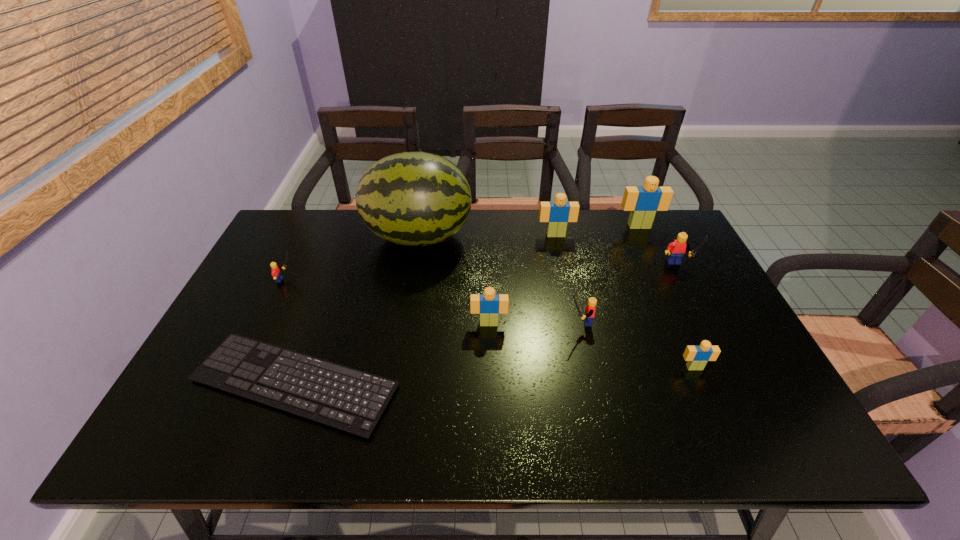
Locate an element on the screen. This screenshot has width=960, height=540. green watermelon is located at coordinates (410, 198).

The width and height of the screenshot is (960, 540). I want to click on the tallest object, so click(x=410, y=198).

This screenshot has width=960, height=540. Identify the location of the eighth shortest object. (643, 201).

The height and width of the screenshot is (540, 960). In order to click on the farthest beige Lego in this screenshot , I will do `click(643, 201)`.

This screenshot has width=960, height=540. I want to click on the third nearest beige Lego, so click(x=557, y=214).

You are a GUI agent. You are given a task and a screenshot of the screen. Output one action in this format:
    pyautogui.click(x=<x>, y=<y>)
    Task: Click on the third beige Lego from right to left
    Image resolution: width=960 pixels, height=540 pixels.
    Given the screenshot: What is the action you would take?
    tap(557, 214)

Identify the location of the rightmost yellow Lego. (x=676, y=250).

In order to click on the leftmost beige Lego in this screenshot , I will do [489, 305].

The image size is (960, 540). Find the location of `the second Lego from left to right`. the second Lego from left to right is located at coordinates (489, 305).

In order to click on the second smallest yellow Lego in this screenshot , I will do `click(590, 308)`.